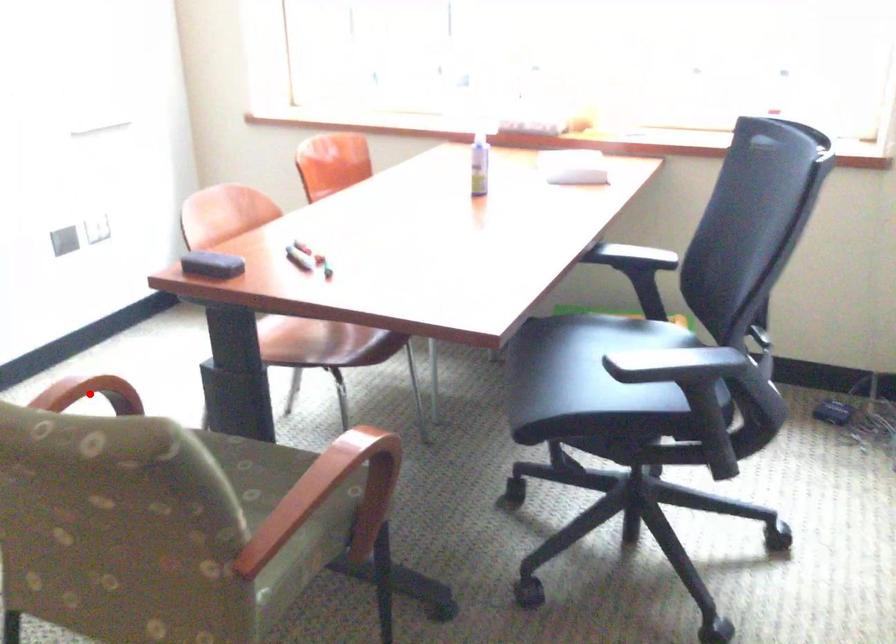
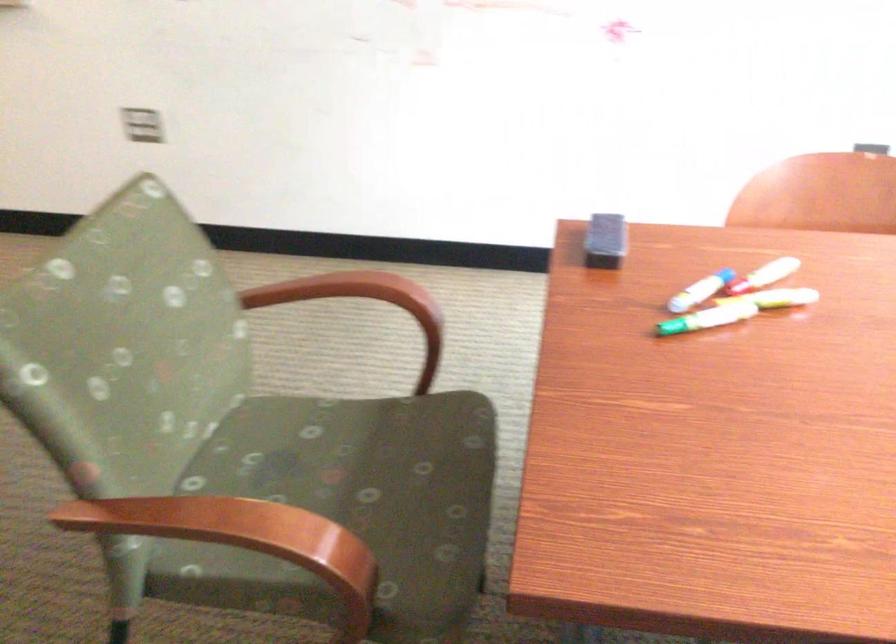
Question: I am providing you with two images of the same scene from different viewpoints. A red point is marked on the first image. At the location where the point appears in image 1, is it still visible in image 2?

Choices:
 (A) Yes
 (B) No

Answer: (B)